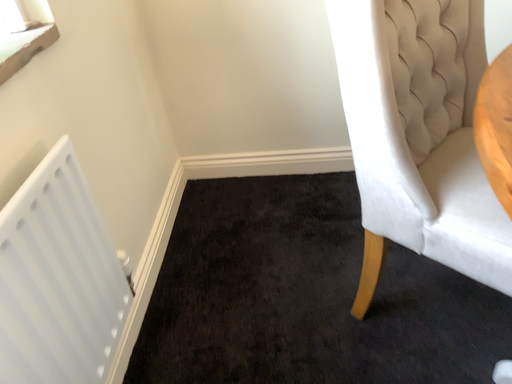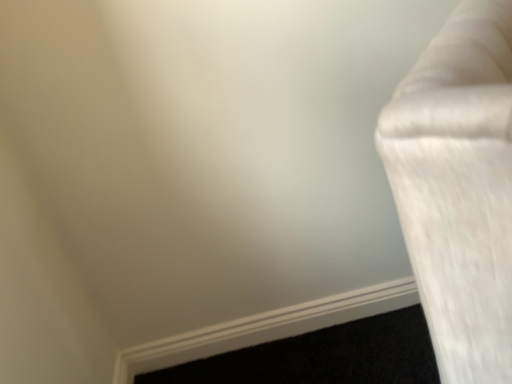
Question: How did the camera likely rotate when shooting the video?

Choices:
 (A) rotated upward
 (B) rotated downward

Answer: (A)